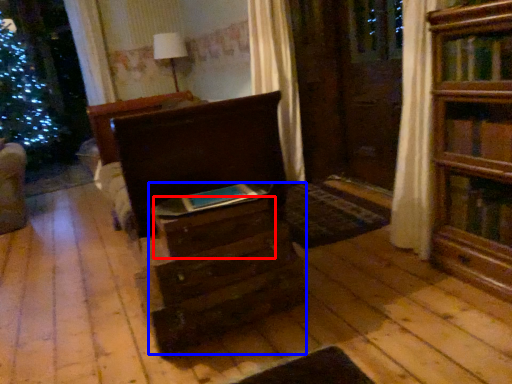
Question: Which of the following is the farthest to the observer, drawer (highlighted by a red box) or drawer (highlighted by a blue box)?

Choices:
 (A) drawer
 (B) drawer

Answer: (A)